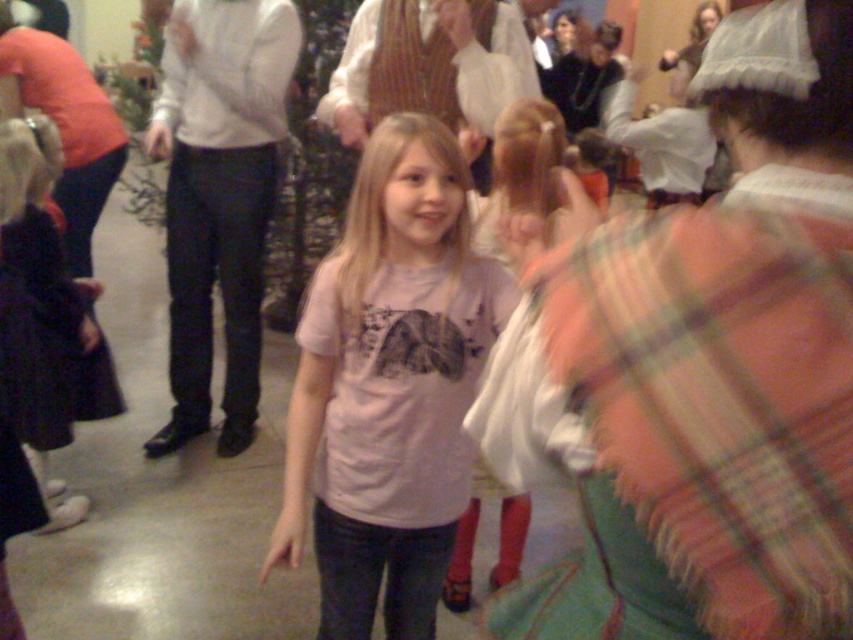
Can you confirm if pink cotton shirt at center is shorter than light pink t-shirt at center?

Incorrect, pink cotton shirt at center's height does not fall short of light pink t-shirt at center's.

Who is lower down, pink cotton shirt at center or light pink t-shirt at center?

pink cotton shirt at center is below.

The width and height of the screenshot is (853, 640). Describe the element at coordinates (389, 385) in the screenshot. I see `pink cotton shirt at center` at that location.

Locate an element on the screen. The image size is (853, 640). pink cotton shirt at center is located at coordinates (389, 385).